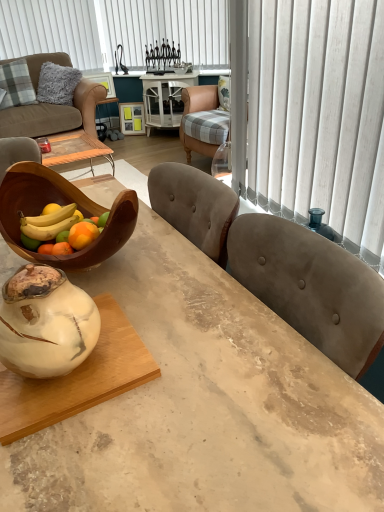
Find the location of a particular element. This screenshot has width=384, height=512. empty space that is ontop of marble table at center (from a real-world perspective) is located at coordinates (144, 354).